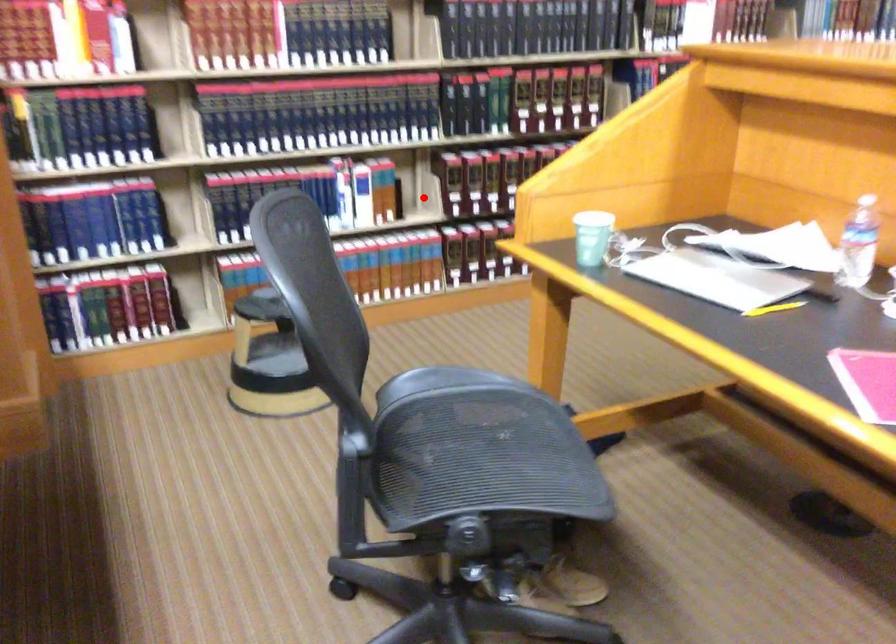
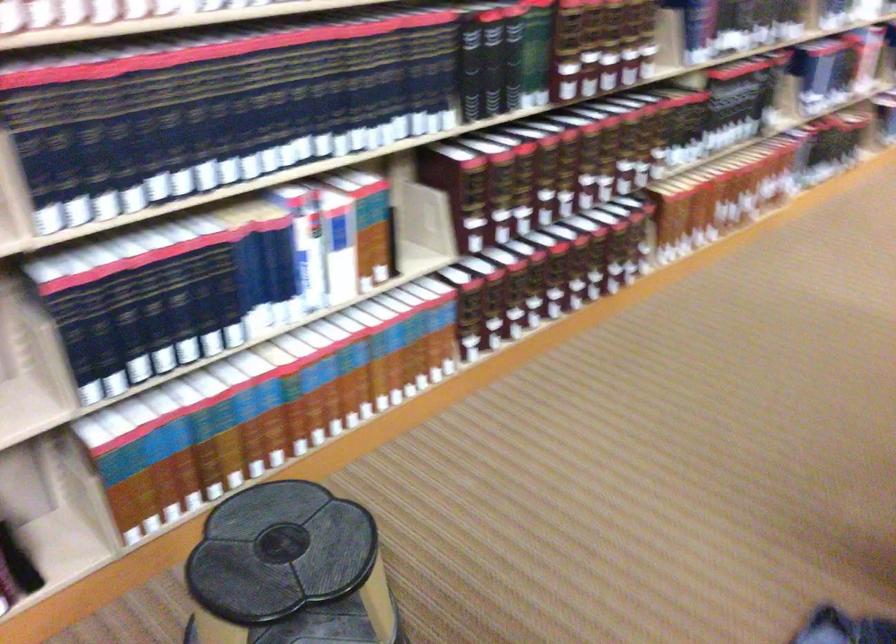
Question: I am providing you with two images of the same scene from different viewpoints. Image1 has a red point marked. In image2, the corresponding 3D location appears at what relative position? Reply with the corresponding letter.

Choices:
 (A) Closer
 (B) Farther

Answer: (A)